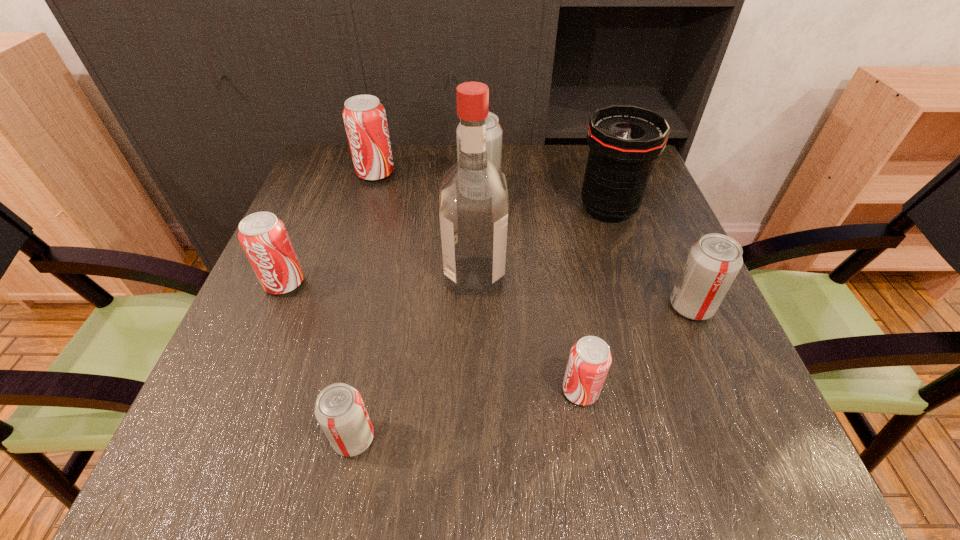
In order to click on red soda can object that ranks as the second closest to the second gray soda can from right to left in this screenshot , I will do `click(264, 238)`.

Identify which gray soda can is the second closest to the tallest object. Please provide its 2D coordinates. Your answer should be formatted as a tuple, i.e. [(x, y)], where the tuple contains the x and y coordinates of a point satisfying the conditions above.

[(340, 411)]

You are a GUI agent. You are given a task and a screenshot of the screen. Output one action in this format:
    pyautogui.click(x=<x>, y=<y>)
    Task: Click on the gray soda can that stands as the closest to the fourth soda can from left to right
    The height and width of the screenshot is (540, 960).
    Given the screenshot: What is the action you would take?
    pyautogui.click(x=713, y=262)

The width and height of the screenshot is (960, 540). In order to click on blank area in the image that satisfies the following two spatial constraints: 1. on the logo side of the leftmost red soda can; 2. on the right side of the smallest gray soda can in this screenshot , I will do `click(219, 438)`.